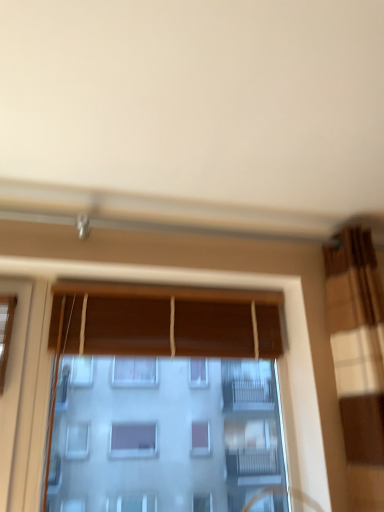
Question: From a real-world perspective, is wooden blinds at center located beneath wooden blinds at center, placed as the first curtain when sorted from left to right?

Choices:
 (A) yes
 (B) no

Answer: (A)

Question: Is wooden blinds at center, the second curtain positioned from the right, at the back of wooden blinds at center?

Choices:
 (A) no
 (B) yes

Answer: (B)

Question: Considering the relative sizes of wooden blinds at center and wooden blinds at center, the second curtain positioned from the right, in the image provided, is wooden blinds at center thinner than wooden blinds at center, the second curtain positioned from the right,?

Choices:
 (A) no
 (B) yes

Answer: (A)

Question: From a real-world perspective, is wooden blinds at center on wooden blinds at center, the second curtain positioned from the right?

Choices:
 (A) yes
 (B) no

Answer: (B)

Question: Considering the relative sizes of wooden blinds at center and wooden blinds at center, the second curtain positioned from the right, in the image provided, is wooden blinds at center taller than wooden blinds at center, the second curtain positioned from the right,?

Choices:
 (A) no
 (B) yes

Answer: (B)

Question: From the image's perspective, is wooden blinds at center positioned above or below brown textured curtain at right, the 1th curtain viewed from the right?

Choices:
 (A) above
 (B) below

Answer: (B)

Question: Is wooden blinds at center taller or shorter than brown textured curtain at right, arranged as the 2th curtain when viewed from the left?

Choices:
 (A) tall
 (B) short

Answer: (B)

Question: From a real-world perspective, is wooden blinds at center above or below brown textured curtain at right, arranged as the 2th curtain when viewed from the left?

Choices:
 (A) below
 (B) above

Answer: (A)

Question: Is wooden blinds at center in front of or behind brown textured curtain at right, arranged as the 2th curtain when viewed from the left, in the image?

Choices:
 (A) behind
 (B) front

Answer: (A)

Question: Looking at their shapes, would you say wooden blinds at center is wider or thinner than wooden blinds at center, placed as the first curtain when sorted from left to right?

Choices:
 (A) wide
 (B) thin

Answer: (A)

Question: Considering the positions of wooden blinds at center and wooden blinds at center, placed as the first curtain when sorted from left to right, in the image, is wooden blinds at center taller or shorter than wooden blinds at center, placed as the first curtain when sorted from left to right,?

Choices:
 (A) short
 (B) tall

Answer: (B)

Question: Do you think wooden blinds at center is within wooden blinds at center, placed as the first curtain when sorted from left to right, or outside of it?

Choices:
 (A) outside
 (B) inside

Answer: (A)

Question: From a real-world perspective, is wooden blinds at center positioned above or below wooden blinds at center, the second curtain positioned from the right?

Choices:
 (A) below
 (B) above

Answer: (A)

Question: Is point (157, 349) positioned closer to the camera than point (352, 262)?

Choices:
 (A) closer
 (B) farther

Answer: (B)

Question: From a real-world perspective, is wooden blinds at center, placed as the first curtain when sorted from left to right, above or below brown textured curtain at right, arranged as the 2th curtain when viewed from the left?

Choices:
 (A) above
 (B) below

Answer: (A)